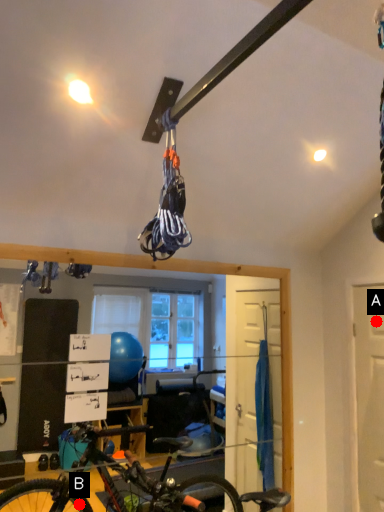
Question: Two points are circled on the image, labeled by A and B beside each circle. Among these points, which one is farthest from the camera?

Choices:
 (A) A is further
 (B) B is further

Answer: (B)